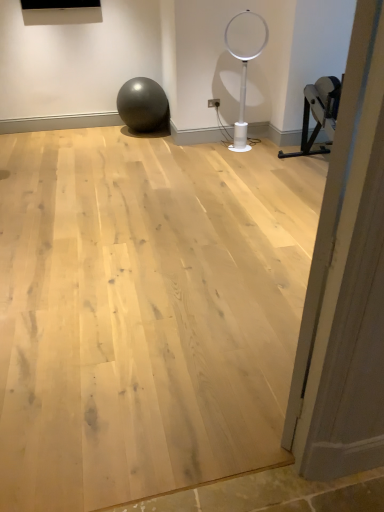
At what (x,y) coordinates should I click in order to perform the action: click on empty space that is in between white plastic basketball hoop at center and wooden door at right. Please return your answer as a coordinate pair (x, y). Looking at the image, I should click on (269, 225).